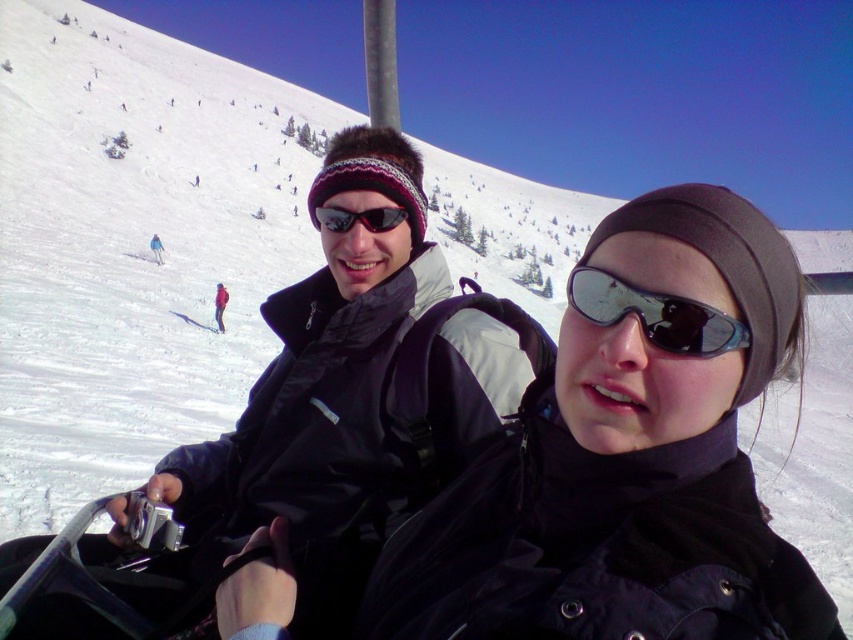
You are a photographer trying to capture the reflection of the two people on the ski lift. Since both are wearing black reflective items, you notice that the black reflective goggles at center and the black reflective sunglasses at center are positioned in a way that might affect the reflection. Which of these two items is located to the right of the other in the scene?

The black reflective goggles at center is positioned on the right side of black reflective sunglasses at center, so in the reflection, the goggles will appear to the right of the sunglasses.

You are a photographer standing at the base of the mountain and want to take a photo of the two people on the ski lift. The black reflective goggles at center are important for the composition. How far apart are the two people on the ski lift?

The two people on the ski lift are 4.97 meters apart.